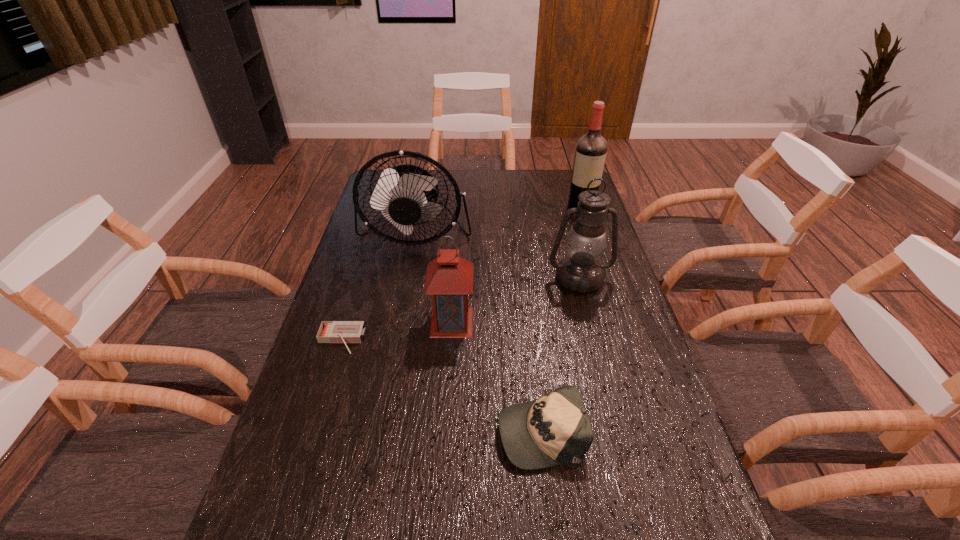
Where is `free location at the left edge`? This screenshot has height=540, width=960. free location at the left edge is located at coordinates (343, 356).

Locate an element on the screen. This screenshot has width=960, height=540. vacant space at the right edge is located at coordinates (591, 356).

Image resolution: width=960 pixels, height=540 pixels. In the image, there is a desktop. In order to click on vacant space at the far right corner in this screenshot , I will do `click(562, 190)`.

You are a GUI agent. You are given a task and a screenshot of the screen. Output one action in this format:
    pyautogui.click(x=<x>, y=<y>)
    Task: Click on the vacant point located between the shortest object and the third shortest object
    
    Given the screenshot: What is the action you would take?
    pyautogui.click(x=396, y=331)

The height and width of the screenshot is (540, 960). I want to click on free space between the matchbox and the second shortest object, so click(x=441, y=386).

Where is `unoccupied position between the shortest object and the nearest object`? This screenshot has height=540, width=960. unoccupied position between the shortest object and the nearest object is located at coordinates (441, 386).

Locate an element on the screen. free area in between the nearest object and the matchbox is located at coordinates (441, 386).

In order to click on vacant region between the liquor and the baseball cap in this screenshot , I will do `click(562, 320)`.

Find the location of `free space between the fan and the shortest object`. free space between the fan and the shortest object is located at coordinates (378, 287).

At what (x,y) coordinates should I click in order to perform the action: click on free space between the nearest object and the lantern. Please return your answer as a coordinate pair (x, y). Looking at the image, I should click on (496, 377).